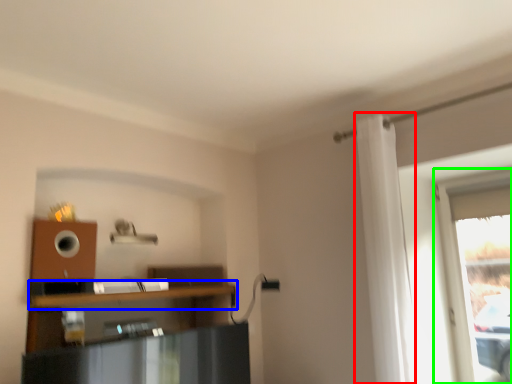
Question: Considering the real-world distances, which object is closest to curtain (highlighted by a red box)? shelf (highlighted by a blue box) or window (highlighted by a green box).

Choices:
 (A) shelf
 (B) window

Answer: (B)